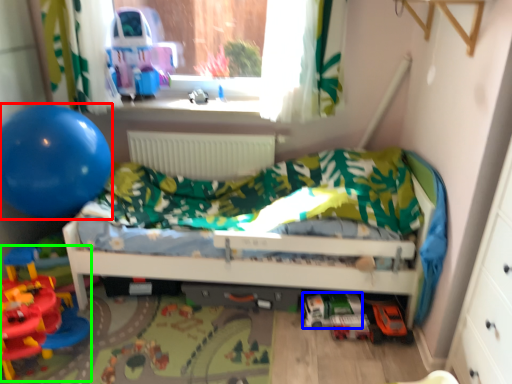
Question: Which object is the farthest from balloon (highlighted by a red box)? Choose among these: toy (highlighted by a blue box) or toy (highlighted by a green box).

Choices:
 (A) toy
 (B) toy

Answer: (A)